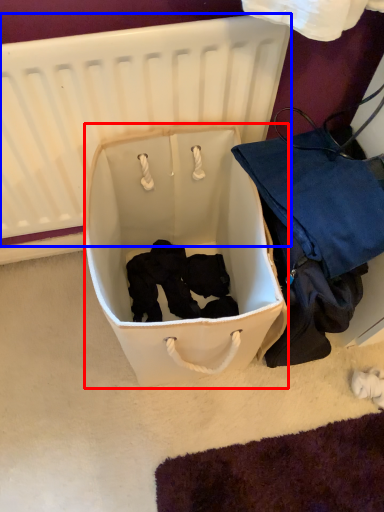
Question: Which object appears closest to the camera in this image, storage box (highlighted by a red box) or infant bed (highlighted by a blue box)?

Choices:
 (A) storage box
 (B) infant bed

Answer: (B)